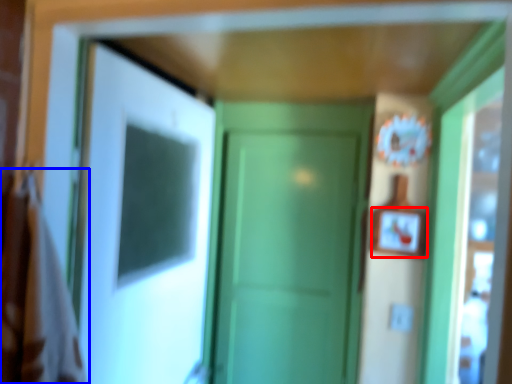
Question: Among these objects, which one is farthest to the camera, picture frame (highlighted by a red box) or laundry (highlighted by a blue box)?

Choices:
 (A) picture frame
 (B) laundry

Answer: (A)